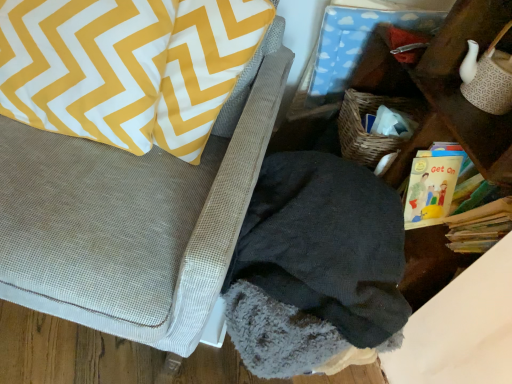
Question: From a real-world perspective, does fuzzy gray blanket at lower right stand above dark fleece blanket at lower right?

Choices:
 (A) no
 (B) yes

Answer: (B)

Question: Are fuzzy gray blanket at lower right and dark fleece blanket at lower right far apart?

Choices:
 (A) no
 (B) yes

Answer: (A)

Question: Is fuzzy gray blanket at lower right behind dark fleece blanket at lower right?

Choices:
 (A) yes
 (B) no

Answer: (B)

Question: From a real-world perspective, is fuzzy gray blanket at lower right below dark fleece blanket at lower right?

Choices:
 (A) no
 (B) yes

Answer: (A)

Question: Does fuzzy gray blanket at lower right appear on the left side of dark fleece blanket at lower right?

Choices:
 (A) yes
 (B) no

Answer: (A)

Question: Does fuzzy gray blanket at lower right have a larger size compared to dark fleece blanket at lower right?

Choices:
 (A) yes
 (B) no

Answer: (A)

Question: Is yellow paper book at right bigger than dark fleece blanket at lower right?

Choices:
 (A) no
 (B) yes

Answer: (A)

Question: Is yellow paper book at right positioned before dark fleece blanket at lower right?

Choices:
 (A) no
 (B) yes

Answer: (A)

Question: Is yellow paper book at right to the left of dark fleece blanket at lower right from the viewer's perspective?

Choices:
 (A) no
 (B) yes

Answer: (A)

Question: From the image's perspective, is yellow paper book at right under dark fleece blanket at lower right?

Choices:
 (A) no
 (B) yes

Answer: (A)

Question: Is yellow paper book at right facing away from dark fleece blanket at lower right?

Choices:
 (A) no
 (B) yes

Answer: (A)

Question: Does yellow paper book at right have a greater height compared to dark fleece blanket at lower right?

Choices:
 (A) yes
 (B) no

Answer: (B)

Question: From the image's perspective, is yellow/white zigzag pillow at upper left over yellow paper book at right?

Choices:
 (A) no
 (B) yes

Answer: (B)